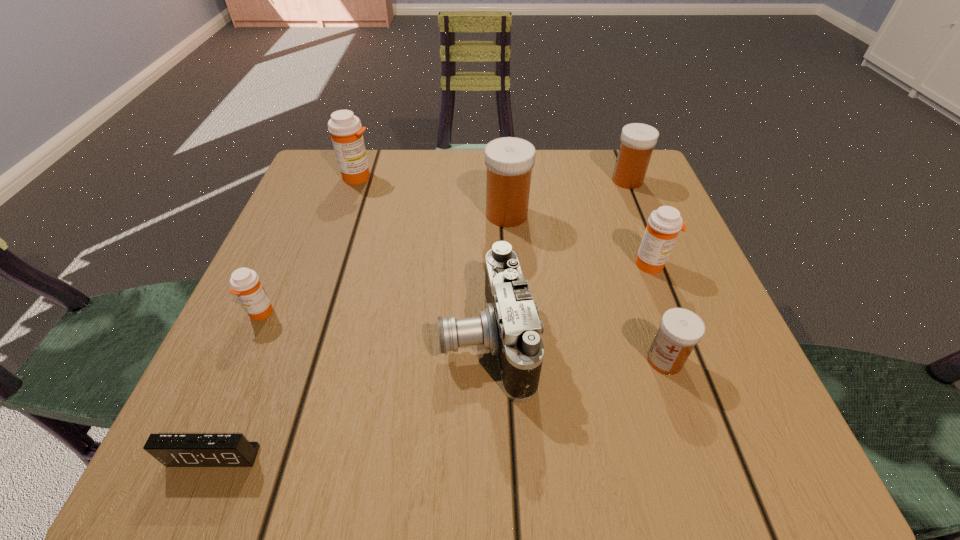
The image size is (960, 540). What are the coordinates of `vacant region that satisfies the following two spatial constraints: 1. on the back side of the farthest white medicine; 2. on the left side of the fourth farthest medicine` in the screenshot? It's located at (619, 180).

You are a GUI agent. You are given a task and a screenshot of the screen. Output one action in this format:
    pyautogui.click(x=<x>, y=<y>)
    Task: Click on the free location that satisfies the following two spatial constraints: 1. on the back side of the fourth medicine from right to left; 2. on the left side of the leftmost medicine
    The height and width of the screenshot is (540, 960).
    Given the screenshot: What is the action you would take?
    pyautogui.click(x=304, y=214)

Where is `free spot that satisfies the following two spatial constraints: 1. on the front side of the smallest white medicine; 2. on the right side of the leftmost white medicine`? This screenshot has height=540, width=960. free spot that satisfies the following two spatial constraints: 1. on the front side of the smallest white medicine; 2. on the right side of the leftmost white medicine is located at coordinates (516, 360).